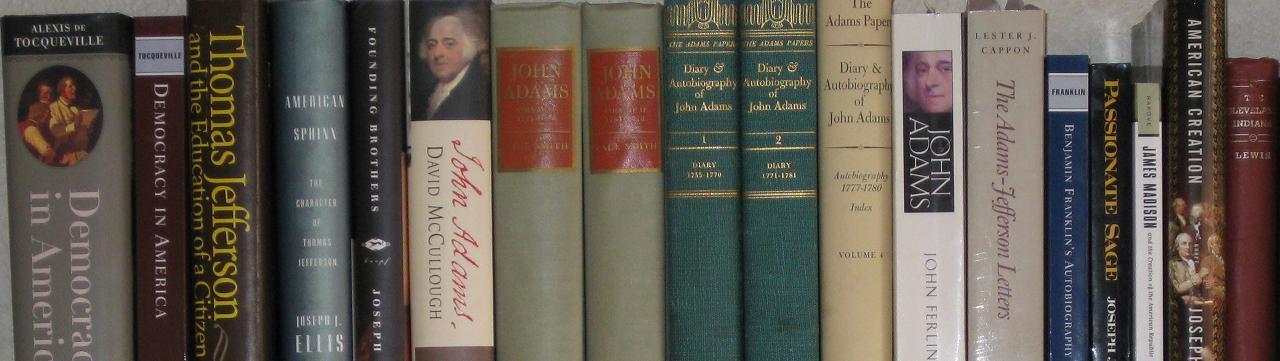
What are the coordinates of `main color of book = black` in the screenshot? It's located at (243, 88), (315, 67), (392, 49), (180, 183), (1124, 203), (1197, 149).